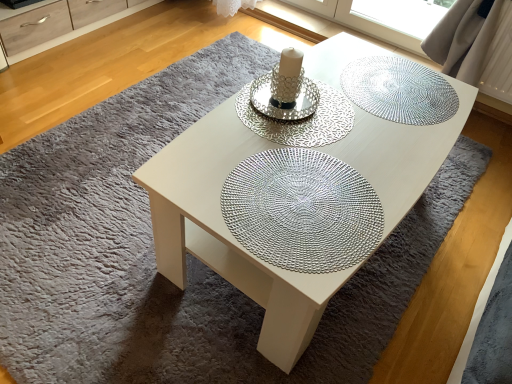
Locate an element on the screen. vacant space underneath silver textured doily at center, the first glass plate in the front-to-back sequence (from a real-world perspective) is located at coordinates (294, 198).